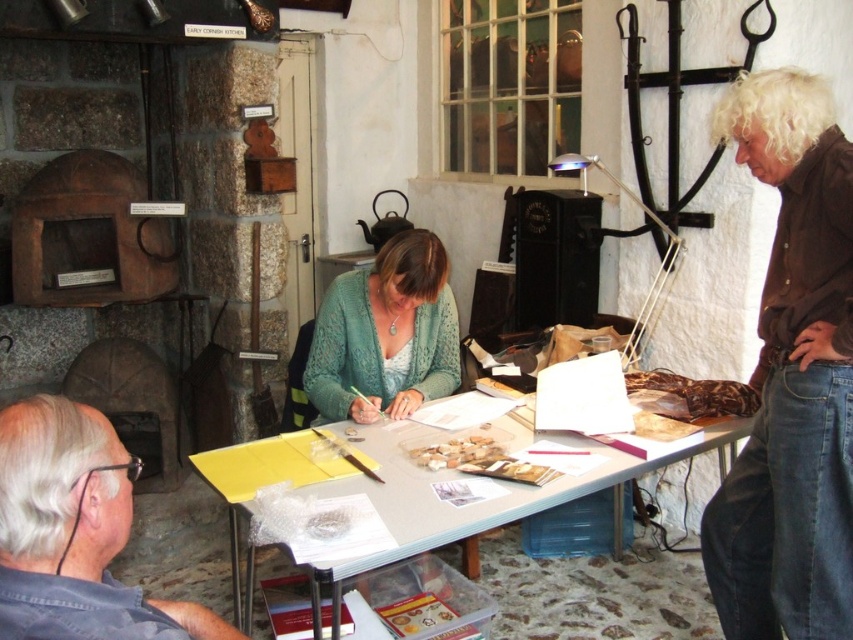
Can you confirm if brown cotton shirt at right is bigger than gray fabric shirt at lower left?

Indeed, brown cotton shirt at right has a larger size compared to gray fabric shirt at lower left.

Between point (834, 528) and point (128, 467), which one is positioned in front?

Point (128, 467) is in front.

Which is in front, point (790, 636) or point (97, 516)?

Point (97, 516) is more forward.

This screenshot has width=853, height=640. In order to click on brown cotton shirt at right in this screenshot , I will do `click(791, 378)`.

Based on the photo, does gray fabric shirt at lower left have a larger size compared to yellow plastic table at center?

No, gray fabric shirt at lower left is not bigger than yellow plastic table at center.

Is gray fabric shirt at lower left smaller than yellow plastic table at center?

Yes, gray fabric shirt at lower left is smaller than yellow plastic table at center.

Which is behind, point (64, 435) or point (401, 445)?

The point (401, 445) is behind.

What are the coordinates of `gray fabric shirt at lower left` in the screenshot? It's located at (74, 529).

Between brown cotton shirt at right and yellow plastic table at center, which one has more height?

brown cotton shirt at right is taller.

Image resolution: width=853 pixels, height=640 pixels. I want to click on brown cotton shirt at right, so click(x=791, y=378).

This screenshot has height=640, width=853. In order to click on brown cotton shirt at right in this screenshot , I will do `click(791, 378)`.